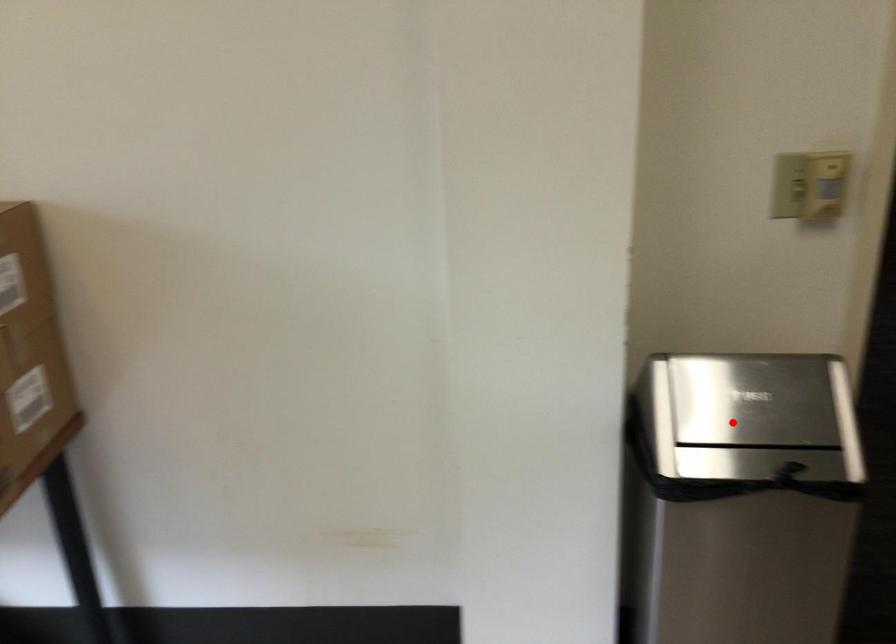
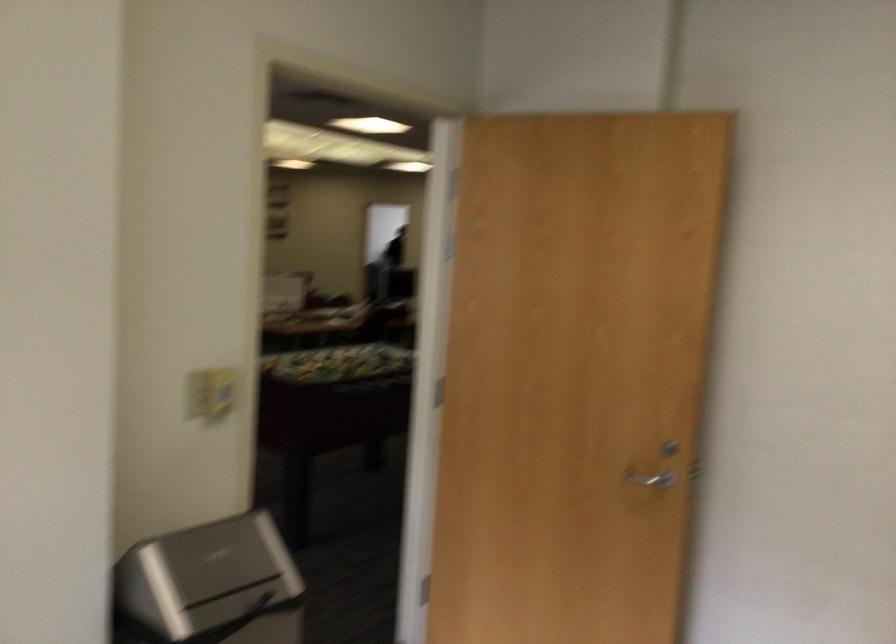
The point at the highlighted location is marked in the first image. Where is the corresponding point in the second image?

(209, 585)